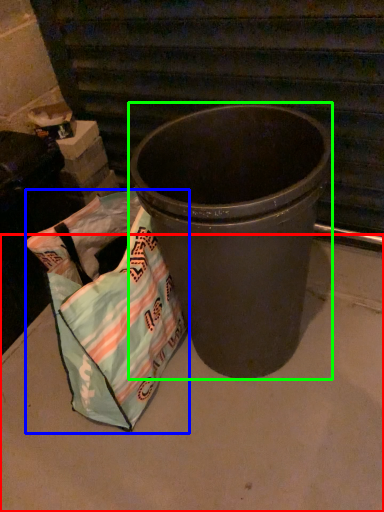
Question: Which object is the farthest from concrete (highlighted by a red box)? Choose among these: grocery bag (highlighted by a blue box) or waste container (highlighted by a green box).

Choices:
 (A) grocery bag
 (B) waste container

Answer: (B)